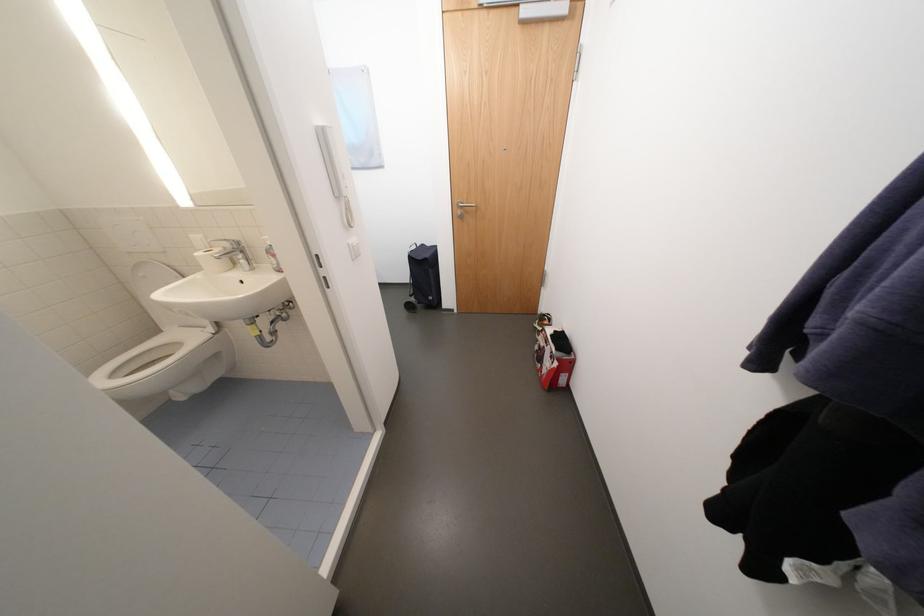
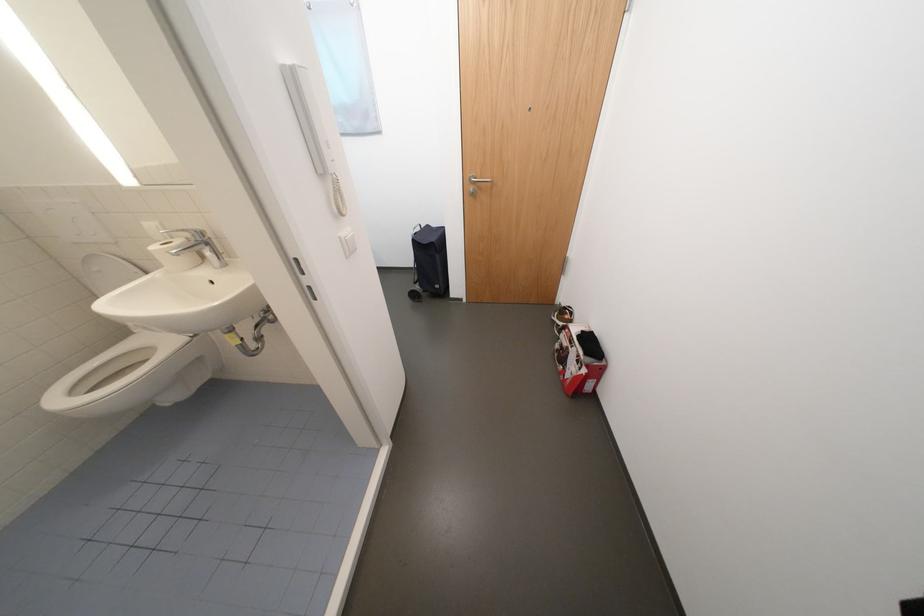
Locate, in the second image, the point that corresponds to pixel 439 299 in the first image.

(445, 286)